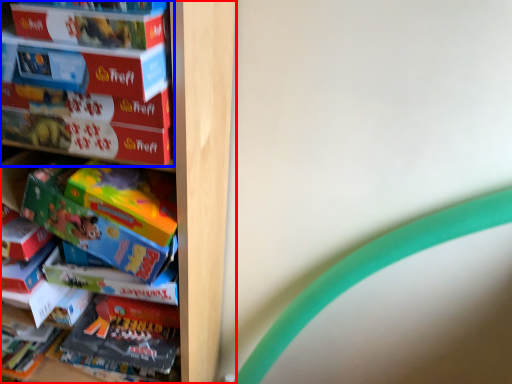
Question: Which point is closer to the camera, shelf (highlighted by a red box) or book (highlighted by a blue box)?

Choices:
 (A) shelf
 (B) book

Answer: (B)